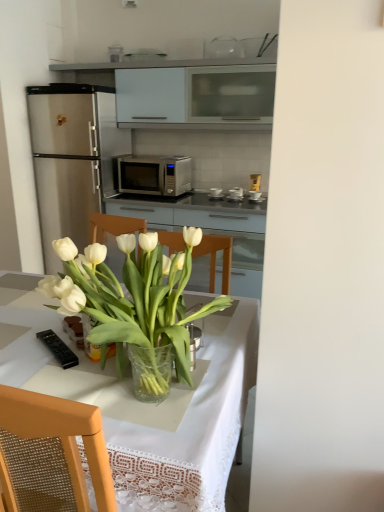
The width and height of the screenshot is (384, 512). Identify the location of free location to the right of black plastic remote control at lower left, acting as the second appliance starting from the right. (102, 359).